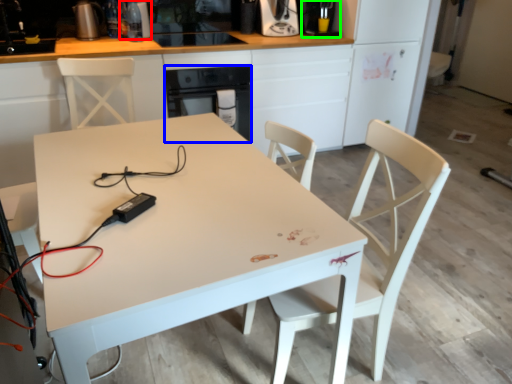
Question: Considering the real-world distances, which object is farthest from appliance (highlighted by a red box)? oven (highlighted by a blue box) or coffee machine (highlighted by a green box)?

Choices:
 (A) oven
 (B) coffee machine

Answer: (B)